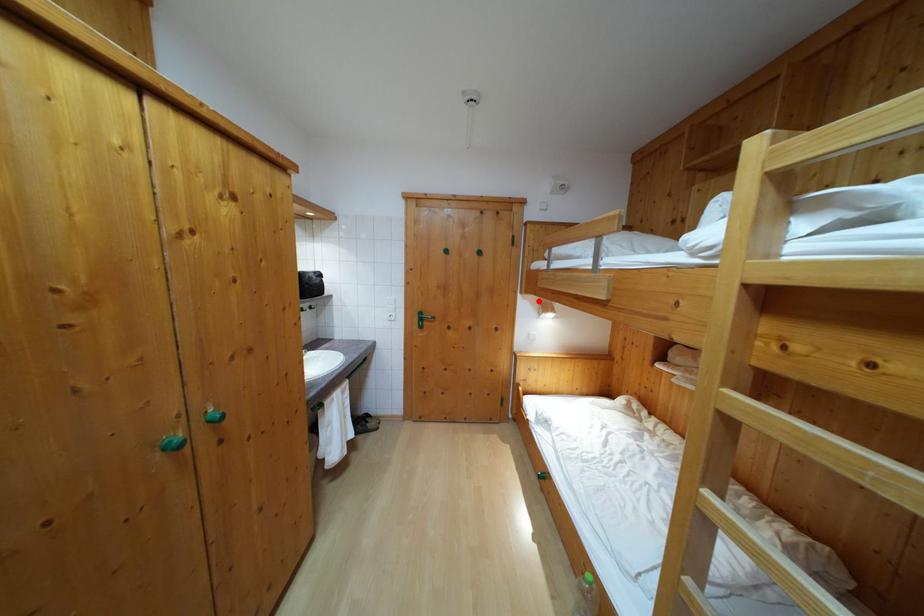
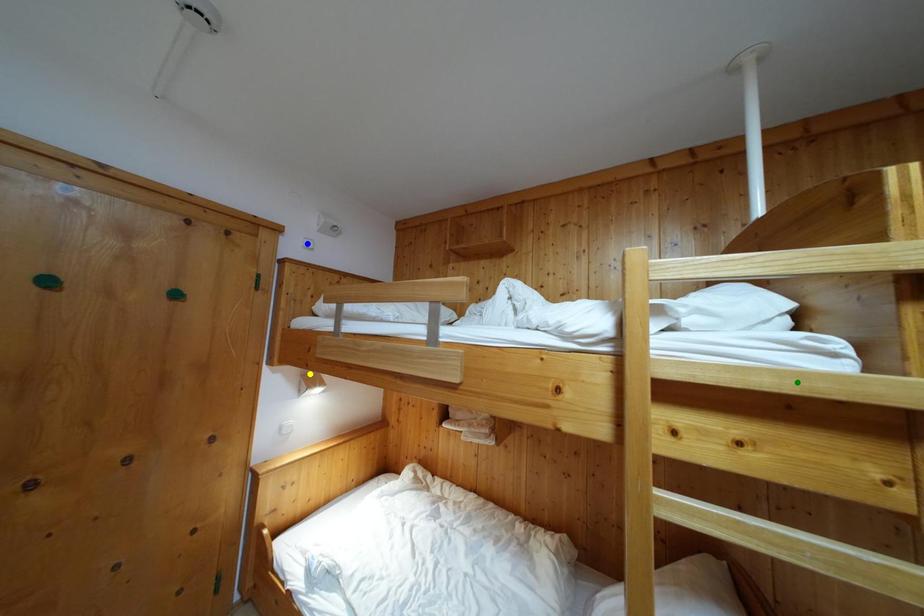
Question: I am providing you with two images of the same scene from different viewpoints. A red point is marked on the first image. You are given multiple points on the second image. Can you choose the point in image 2 that corresponds to the point in image 1?

Choices:
 (A) blue point
 (B) green point
 (C) yellow point

Answer: (C)